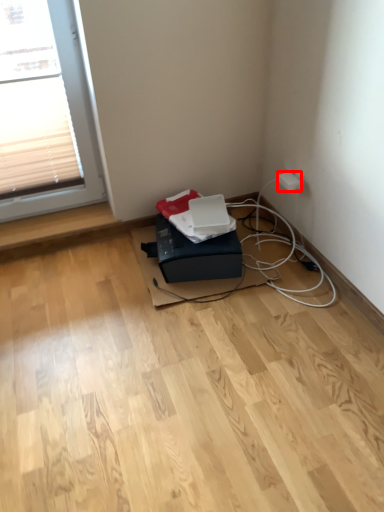
Question: Considering the relative positions of electric outlet (annotated by the red box) and box in the image provided, where is electric outlet (annotated by the red box) located with respect to the staircase?

Choices:
 (A) right
 (B) left

Answer: (A)